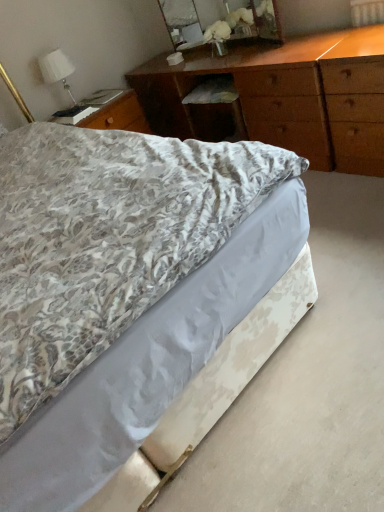
Question: Is white fabric lampshade at upper left located outside floral-patterned fabric bed at center?

Choices:
 (A) yes
 (B) no

Answer: (A)

Question: Could you tell me if white fabric lampshade at upper left is turned towards floral-patterned fabric bed at center?

Choices:
 (A) no
 (B) yes

Answer: (A)

Question: Is white fabric lampshade at upper left oriented away from floral-patterned fabric bed at center?

Choices:
 (A) yes
 (B) no

Answer: (B)

Question: Can you confirm if white fabric lampshade at upper left is positioned to the left of floral-patterned fabric bed at center?

Choices:
 (A) yes
 (B) no

Answer: (A)

Question: Would you consider white fabric lampshade at upper left to be distant from floral-patterned fabric bed at center?

Choices:
 (A) yes
 (B) no

Answer: (A)

Question: Which is correct: wooden mirror at upper center is inside wooden chest of drawers at upper center, or outside of it?

Choices:
 (A) outside
 (B) inside

Answer: (A)

Question: From the image's perspective, relative to wooden chest of drawers at upper center, is wooden mirror at upper center above or below?

Choices:
 (A) above
 (B) below

Answer: (A)

Question: Is wooden mirror at upper center to the left or to the right of wooden chest of drawers at upper center in the image?

Choices:
 (A) right
 (B) left

Answer: (B)

Question: From a real-world perspective, is wooden mirror at upper center physically located above or below wooden chest of drawers at upper center?

Choices:
 (A) below
 (B) above

Answer: (B)

Question: Is white fabric lampshade at upper left to the left or to the right of wooden chest of drawers at upper center in the image?

Choices:
 (A) left
 (B) right

Answer: (A)

Question: Is white fabric lampshade at upper left wider or thinner than wooden chest of drawers at upper center?

Choices:
 (A) thin
 (B) wide

Answer: (A)

Question: Considering the positions of white fabric lampshade at upper left and wooden chest of drawers at upper center in the image, is white fabric lampshade at upper left taller or shorter than wooden chest of drawers at upper center?

Choices:
 (A) short
 (B) tall

Answer: (A)

Question: Is white fabric lampshade at upper left inside or outside of wooden chest of drawers at upper center?

Choices:
 (A) inside
 (B) outside

Answer: (B)

Question: From a real-world perspective, is wooden mirror at upper center above or below white fabric lampshade at upper left?

Choices:
 (A) below
 (B) above

Answer: (A)

Question: From the image's perspective, is wooden mirror at upper center positioned above or below white fabric lampshade at upper left?

Choices:
 (A) below
 (B) above

Answer: (B)